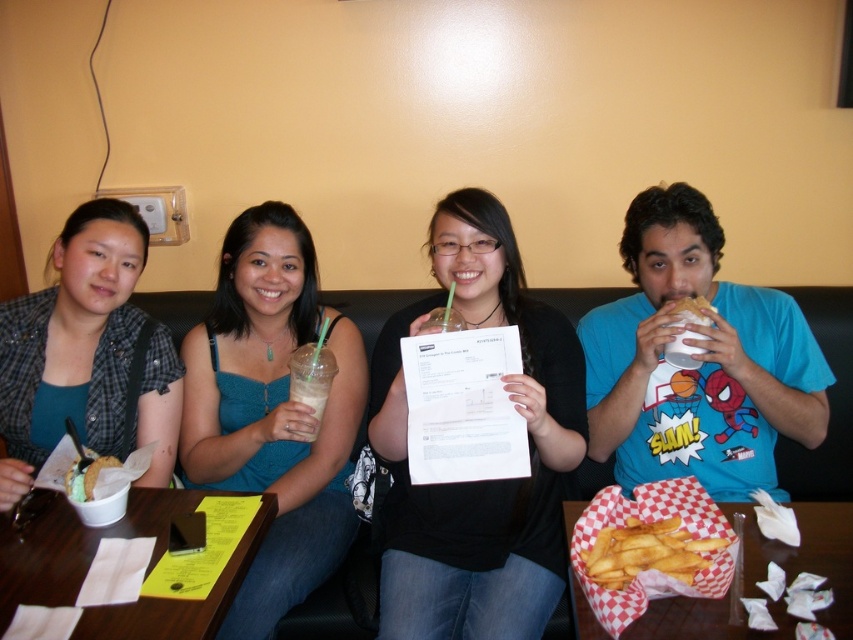
You are looking at the image and want to focus on the two points labeled as point (701, 561) and point (68, 483). Which of these two points is nearer to you?

Point (701, 561) is closer to you than point (68, 483).

You are a waiter holding a tray with a 20 inch wide dish. You need to place it between the matte plaid shirt at left and the iced coffee at center. Is there enough space?

The matte plaid shirt at left is 19.02 inches from the iced coffee at center. Since the dish is 20 inches wide, it cannot fit between them as the space is narrower than the dish.